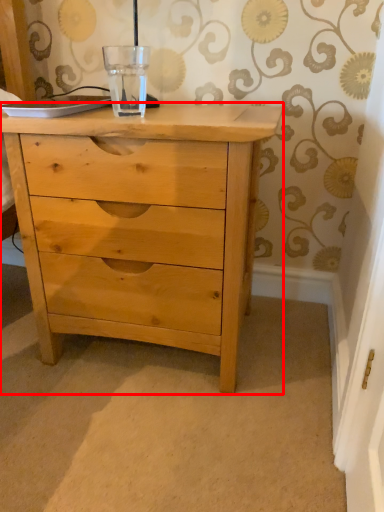
Question: In this image, where is chest of drawers (annotated by the red box) located relative to glass vase?

Choices:
 (A) left
 (B) right

Answer: (B)